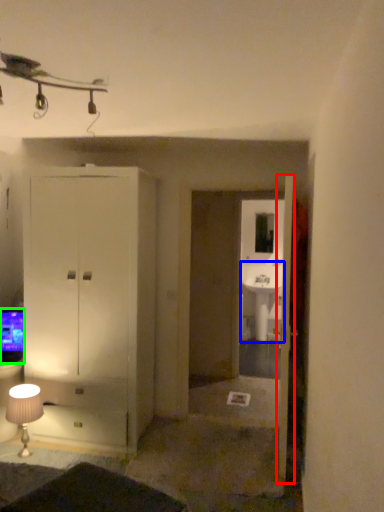
Question: Which is nearer to the door (highlighted by a red box)? sink (highlighted by a blue box) or television (highlighted by a green box).

Choices:
 (A) sink
 (B) television

Answer: (B)